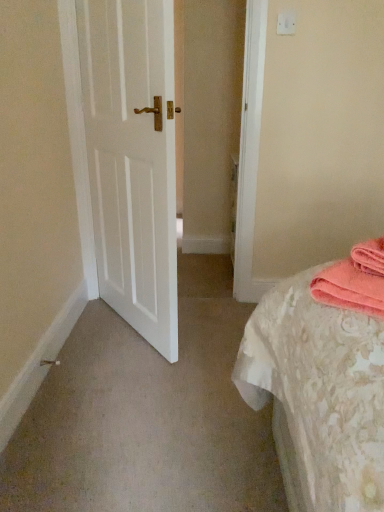
Question: Is white matte door at left far from pink towel at right?

Choices:
 (A) yes
 (B) no

Answer: (A)

Question: Does white matte door at left have a lesser width compared to pink towel at right?

Choices:
 (A) no
 (B) yes

Answer: (B)

Question: Is white matte door at left facing towards pink towel at right?

Choices:
 (A) yes
 (B) no

Answer: (B)

Question: Does white matte door at left have a greater height compared to pink towel at right?

Choices:
 (A) yes
 (B) no

Answer: (A)

Question: From the image's perspective, is white matte door at left below pink towel at right?

Choices:
 (A) no
 (B) yes

Answer: (A)

Question: Relative to white plastic light switch at upper center, is pink towel at right in front or behind?

Choices:
 (A) front
 (B) behind

Answer: (A)

Question: Would you say pink towel at right is to the left or to the right of white plastic light switch at upper center in the picture?

Choices:
 (A) left
 (B) right

Answer: (B)

Question: Do you think pink towel at right is within white plastic light switch at upper center, or outside of it?

Choices:
 (A) outside
 (B) inside

Answer: (A)

Question: Is pink towel at right bigger or smaller than white plastic light switch at upper center?

Choices:
 (A) big
 (B) small

Answer: (A)

Question: Is point (278, 14) closer or farther from the camera than point (327, 288)?

Choices:
 (A) closer
 (B) farther

Answer: (B)

Question: Considering the positions of white plastic light switch at upper center and pink towel at right in the image, is white plastic light switch at upper center wider or thinner than pink towel at right?

Choices:
 (A) wide
 (B) thin

Answer: (B)

Question: From their relative heights in the image, would you say white plastic light switch at upper center is taller or shorter than pink towel at right?

Choices:
 (A) tall
 (B) short

Answer: (B)

Question: Visually, is white plastic light switch at upper center positioned to the left or to the right of pink towel at right?

Choices:
 (A) right
 (B) left

Answer: (B)

Question: From their relative heights in the image, would you say white plastic light switch at upper center is taller or shorter than white matte door at left?

Choices:
 (A) tall
 (B) short

Answer: (B)

Question: Is point (279, 20) closer or farther from the camera than point (160, 132)?

Choices:
 (A) farther
 (B) closer

Answer: (A)